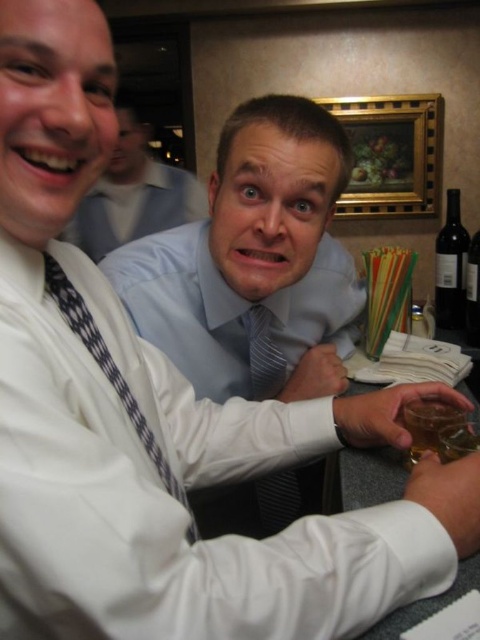
Question: Which object is the closest to the dark glass bottle at right?

Choices:
 (A) black checkered tie at center
 (B) dark glass bottle at upper right
 (C) blue striped tie at center

Answer: (B)

Question: Does smooth gray table at lower right lie behind dark glass bottle at upper right?

Choices:
 (A) no
 (B) yes

Answer: (A)

Question: Which point appears farthest from the camera in this image?

Choices:
 (A) (261, 330)
 (B) (452, 410)
 (C) (464, 298)
 (D) (476, 266)

Answer: (C)

Question: Among these objects, which one is nearest to the camera?

Choices:
 (A) dark glass bottle at upper right
 (B) black checkered tie at center

Answer: (B)

Question: Is smooth gray table at lower right bigger than striped fabric tie at center?

Choices:
 (A) no
 (B) yes

Answer: (B)

Question: Does black checkered tie at center have a lesser width compared to dark glass bottle at upper right?

Choices:
 (A) no
 (B) yes

Answer: (A)